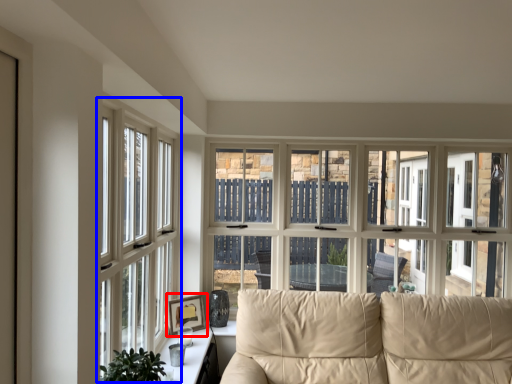
Question: Among these objects, which one is farthest to the camera, picture frame (highlighted by a red box) or window (highlighted by a blue box)?

Choices:
 (A) picture frame
 (B) window

Answer: (A)